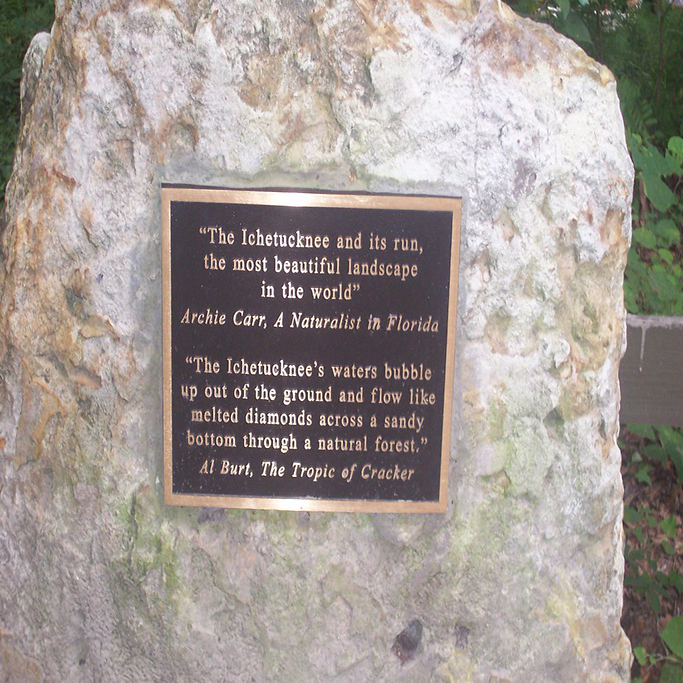
This screenshot has height=683, width=683. Identify the location of wall behind large stone. (660, 380).